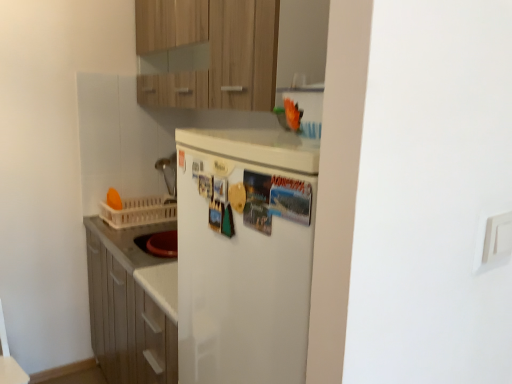
Question: Does white matte refrigerator at center have a larger size compared to wooden cabinet at upper center?

Choices:
 (A) yes
 (B) no

Answer: (B)

Question: Is white matte refrigerator at center outside of wooden cabinet at upper center?

Choices:
 (A) yes
 (B) no

Answer: (A)

Question: Can you confirm if white matte refrigerator at center is shorter than wooden cabinet at upper center?

Choices:
 (A) yes
 (B) no

Answer: (A)

Question: From the image's perspective, does white matte refrigerator at center appear lower than wooden cabinet at upper center?

Choices:
 (A) no
 (B) yes

Answer: (B)

Question: Is white matte refrigerator at center thinner than wooden cabinet at upper center?

Choices:
 (A) no
 (B) yes

Answer: (B)

Question: Considering the relative sizes of white matte refrigerator at center and wooden cabinet at upper center in the image provided, is white matte refrigerator at center smaller than wooden cabinet at upper center?

Choices:
 (A) no
 (B) yes

Answer: (B)

Question: From a real-world perspective, is wooden cabinet at upper center under white matte refrigerator at center?

Choices:
 (A) yes
 (B) no

Answer: (B)

Question: Considering the relative sizes of wooden cabinet at upper center and white matte refrigerator at center in the image provided, is wooden cabinet at upper center taller than white matte refrigerator at center?

Choices:
 (A) no
 (B) yes

Answer: (B)

Question: Can you confirm if wooden cabinet at upper center is wider than white matte refrigerator at center?

Choices:
 (A) no
 (B) yes

Answer: (B)

Question: From the image's perspective, would you say wooden cabinet at upper center is shown under white matte refrigerator at center?

Choices:
 (A) yes
 (B) no

Answer: (B)

Question: Does wooden cabinet at upper center appear on the left side of white matte refrigerator at center?

Choices:
 (A) yes
 (B) no

Answer: (A)

Question: Considering the relative positions of wooden cabinet at upper center and white matte refrigerator at center in the image provided, is wooden cabinet at upper center behind white matte refrigerator at center?

Choices:
 (A) yes
 (B) no

Answer: (A)

Question: Considering the relative sizes of wooden cabinet at upper center and white plastic basket at left in the image provided, is wooden cabinet at upper center smaller than white plastic basket at left?

Choices:
 (A) no
 (B) yes

Answer: (A)